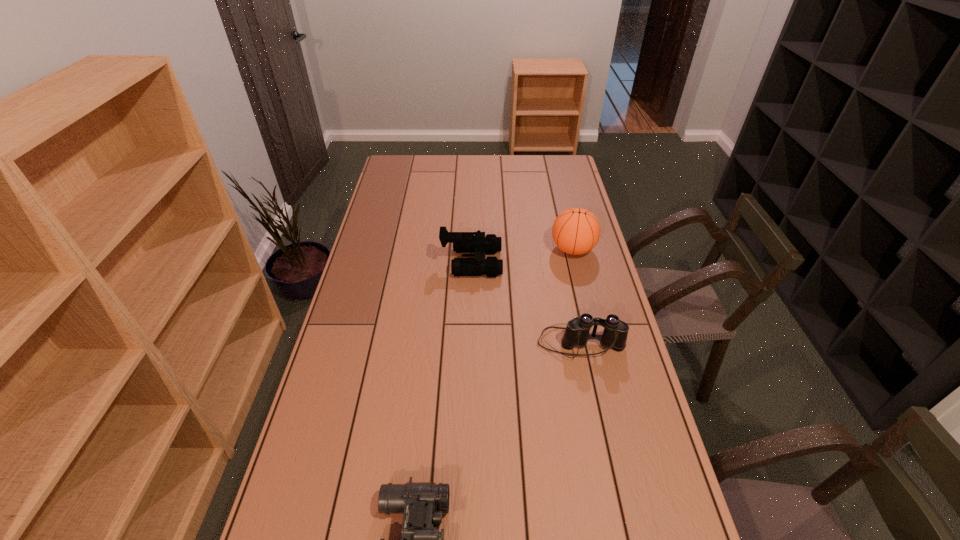
Identify the location of basketball. (576, 231).

This screenshot has height=540, width=960. What are the coordinates of `the farthest binoculars` in the screenshot? It's located at (463, 242).

Locate an element on the screen. the second farthest binoculars is located at coordinates click(x=614, y=336).

At what (x,y) coordinates should I click in order to perform the action: click on the rightmost binoculars. Please return your answer as a coordinate pair (x, y). Image resolution: width=960 pixels, height=540 pixels. Looking at the image, I should click on (614, 336).

This screenshot has width=960, height=540. Identify the location of vacant region located 0.340m on the front of the tallest object. (593, 334).

The image size is (960, 540). Identify the location of blank space located on the front lenses of the farthest binoculars. (528, 262).

Find the location of a particular element. The image size is (960, 540). vacant region located 0.250m on the front of the second farthest binoculars is located at coordinates (601, 441).

Find the location of a particular element. The height and width of the screenshot is (540, 960). basketball that is positioned at the right edge is located at coordinates (576, 231).

This screenshot has width=960, height=540. I want to click on binoculars that is at the right edge, so click(x=614, y=336).

Find the location of a particular element. vacant region at the far edge of the desktop is located at coordinates (493, 170).